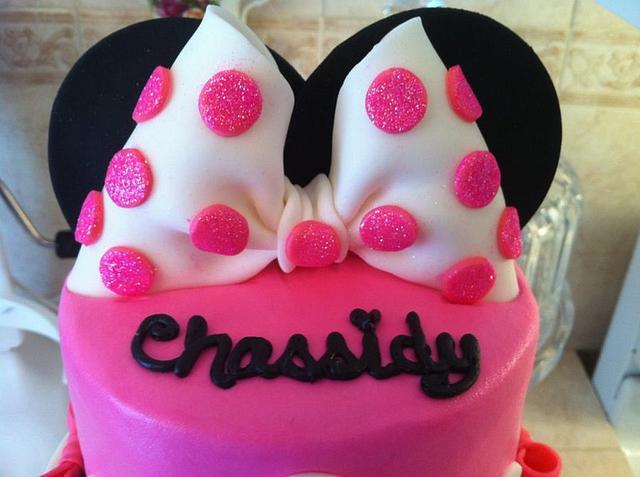
Find the location of a particular element. This screenshot has width=640, height=477. wall is located at coordinates (604, 71).